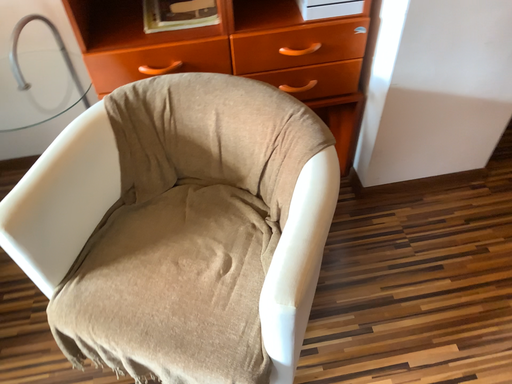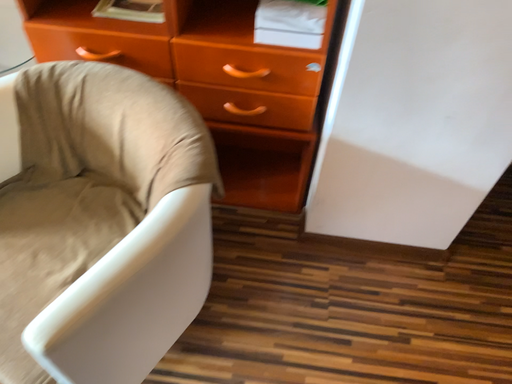
Question: Which way did the camera rotate in the video?

Choices:
 (A) rotated left
 (B) rotated right

Answer: (A)